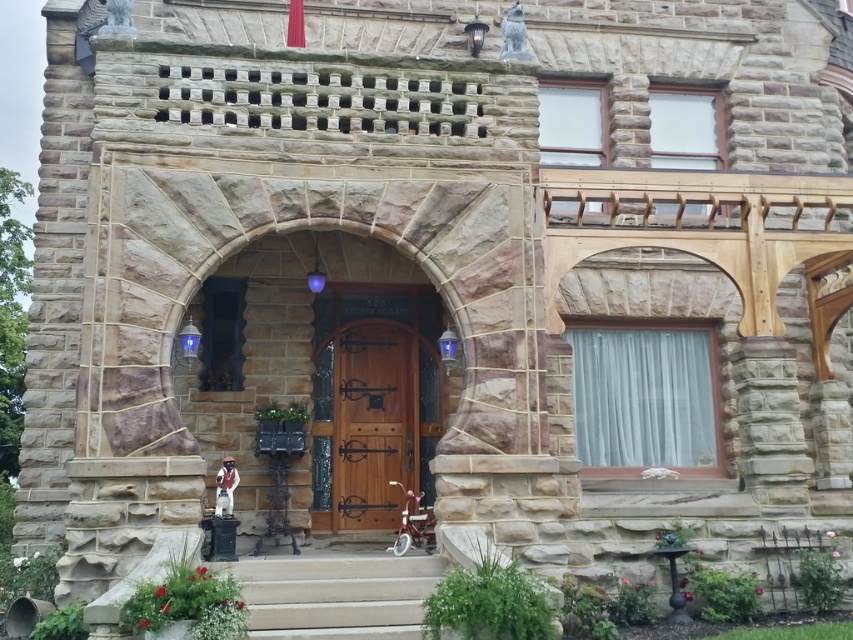
You are a delivery person with a package that requires a cart to transport. The cart you have is 10 feet long. You need to move the cart from the smooth concrete stairs at lower center to the wooden door at center. Is there enough space to move the cart through the path between them?

The wooden door at center is 10.01 feet from the smooth concrete stairs at lower center. Since the distance between them is just over 10 feet, the cart which is 10 feet long can fit through the path between them as there is sufficient space.

You are a delivery person trying to deliver a package to the house. The package is too large to fit through the wooden door at center. Can you use the smooth concrete stairs at lower center to reach another entrance? Explain your reasoning.

The wooden door at center is thinner than the smooth concrete stairs at lower center. However, the smooth concrete stairs at lower center are part of the main entrance and do not lead to another entrance. The package cannot be delivered through the wooden door at center, but there is no alternative entrance mentioned in the scene description.